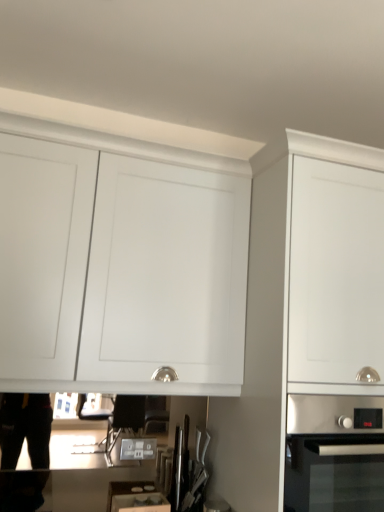
Question: Which direction should I rotate to look at white matte cabinet at center, placed as the 2th cabinetry when sorted from left to right?

Choices:
 (A) right
 (B) left

Answer: (A)

Question: Could you tell me if stainless steel knife block at center is turned towards stainless steel oven at lower right?

Choices:
 (A) no
 (B) yes

Answer: (A)

Question: From a real-world perspective, is stainless steel knife block at center positioned under stainless steel oven at lower right based on gravity?

Choices:
 (A) yes
 (B) no

Answer: (A)

Question: Does stainless steel knife block at center have a smaller size compared to stainless steel oven at lower right?

Choices:
 (A) no
 (B) yes

Answer: (B)

Question: Can you confirm if stainless steel knife block at center is shorter than stainless steel oven at lower right?

Choices:
 (A) yes
 (B) no

Answer: (A)

Question: Can you confirm if stainless steel knife block at center is thinner than stainless steel oven at lower right?

Choices:
 (A) no
 (B) yes

Answer: (B)

Question: Is stainless steel knife block at center further to the viewer compared to stainless steel oven at lower right?

Choices:
 (A) no
 (B) yes

Answer: (B)

Question: Does stainless steel knife block at center have a greater height compared to white matte cabinet at center, placed as the 2th cabinetry when sorted from left to right?

Choices:
 (A) yes
 (B) no

Answer: (B)

Question: Is stainless steel knife block at center at the right side of white matte cabinet at center, placed as the 2th cabinetry when sorted from left to right?

Choices:
 (A) yes
 (B) no

Answer: (B)

Question: Would you consider stainless steel knife block at center to be distant from white matte cabinet at center, placed as the 1th cabinetry when sorted from right to left?

Choices:
 (A) no
 (B) yes

Answer: (A)

Question: Is stainless steel knife block at center thinner than white matte cabinet at center, placed as the 1th cabinetry when sorted from right to left?

Choices:
 (A) yes
 (B) no

Answer: (A)

Question: Is stainless steel knife block at center looking in the opposite direction of white matte cabinet at center, placed as the 1th cabinetry when sorted from right to left?

Choices:
 (A) no
 (B) yes

Answer: (A)

Question: From a real-world perspective, does stainless steel knife block at center sit lower than white matte cabinet at center, placed as the 2th cabinetry when sorted from left to right?

Choices:
 (A) yes
 (B) no

Answer: (A)

Question: Considering the relative sizes of stainless steel oven at lower right and white matte cabinet at upper center, placed as the 1th cabinetry when sorted from left to right, in the image provided, is stainless steel oven at lower right bigger than white matte cabinet at upper center, placed as the 1th cabinetry when sorted from left to right,?

Choices:
 (A) yes
 (B) no

Answer: (B)